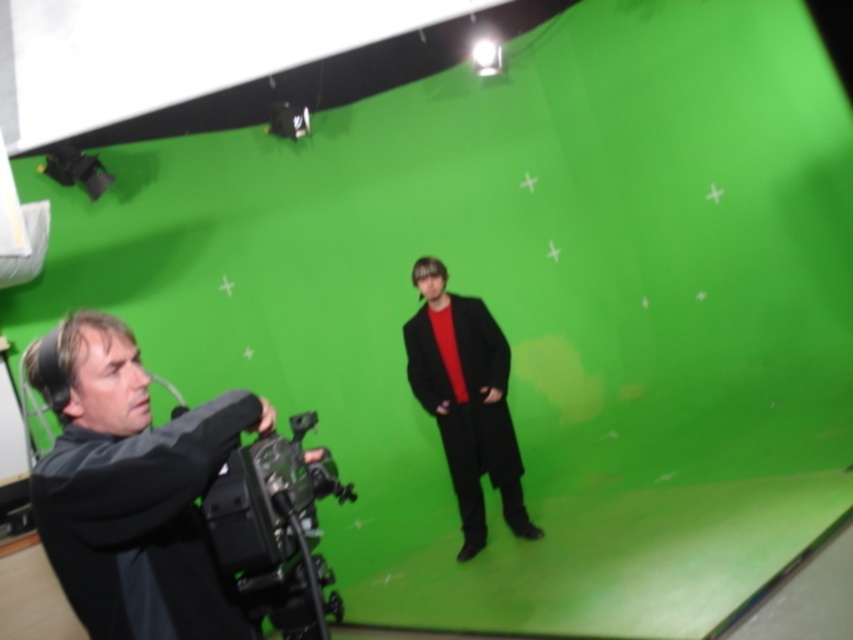
Question: From the image, what is the correct spatial relationship of dark gray fabric camera at lower left in relation to black plastic video camera at lower left?

Choices:
 (A) above
 (B) below

Answer: (A)

Question: Which object is closer to the camera taking this photo?

Choices:
 (A) matte black coat at center
 (B) black plastic video camera at lower left
 (C) dark gray fabric camera at lower left

Answer: (C)

Question: Which point is farther to the camera?

Choices:
 (A) dark gray fabric camera at lower left
 (B) matte black coat at center

Answer: (B)

Question: Which of the following is the closest to the observer?

Choices:
 (A) (244, 518)
 (B) (427, 332)

Answer: (A)

Question: Is dark gray fabric camera at lower left to the left of matte black coat at center from the viewer's perspective?

Choices:
 (A) yes
 (B) no

Answer: (A)

Question: From the image, what is the correct spatial relationship of dark gray fabric camera at lower left in relation to matte black coat at center?

Choices:
 (A) right
 (B) left

Answer: (B)